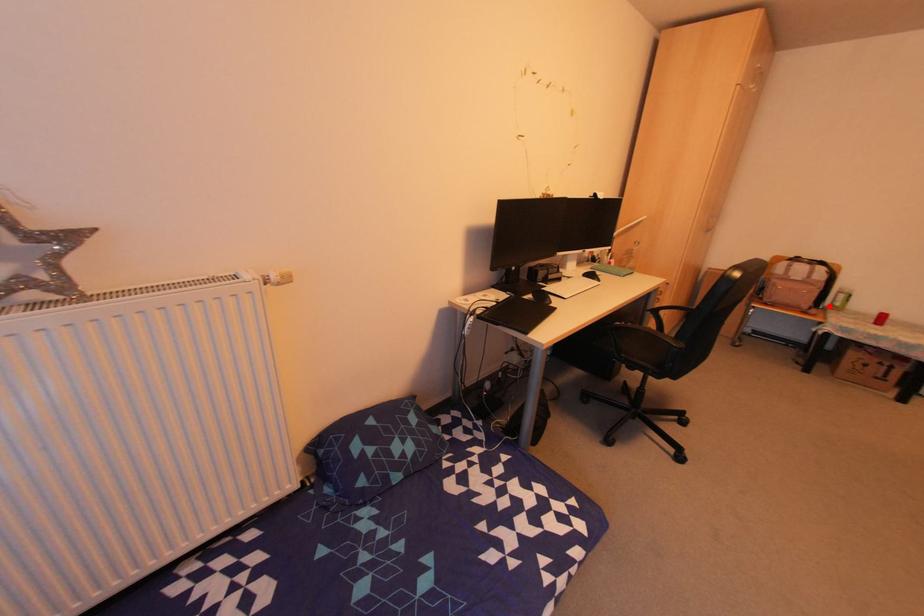
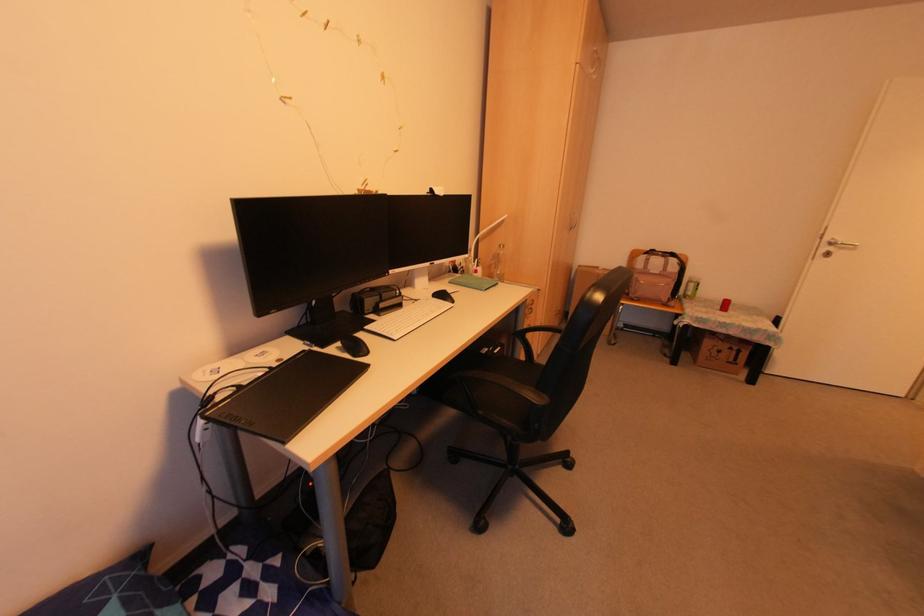
Question: A red point is marked in image1. In image2, is the corresponding 3D point closer to the camera or farther? Reply with the corresponding letter.

Choices:
 (A) The corresponding 3D point is closer.
 (B) The corresponding 3D point is farther.

Answer: (A)